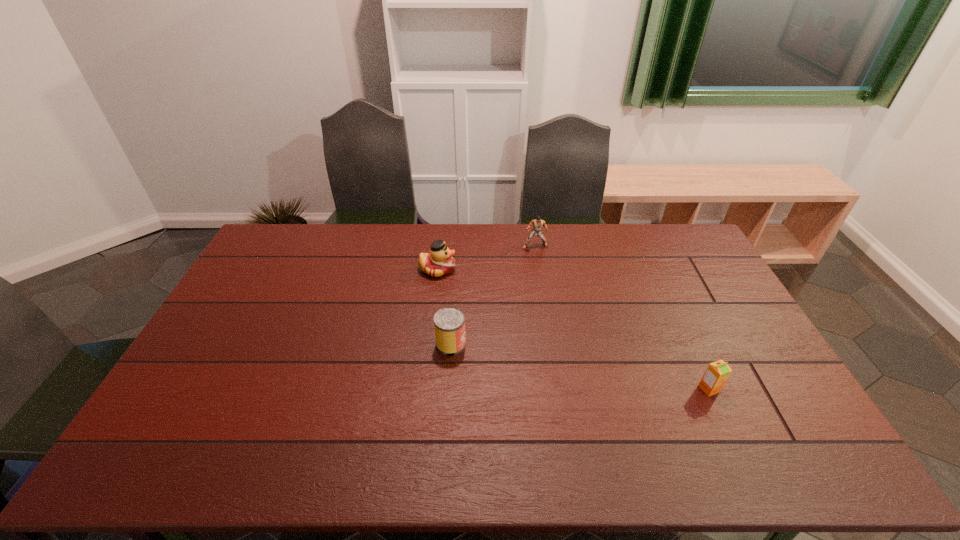
Locate an element on the screen. Image resolution: width=960 pixels, height=540 pixels. object that is the second closest to the second farthest object is located at coordinates (537, 224).

Locate an element on the screen. The width and height of the screenshot is (960, 540). vacant region that satisfies the following two spatial constraints: 1. on the front-facing side of the puncher; 2. on the face of the duck is located at coordinates (539, 269).

You are a GUI agent. You are given a task and a screenshot of the screen. Output one action in this format:
    pyautogui.click(x=<x>, y=<y>)
    Task: Click on the vacant space that satisfies the following two spatial constraints: 1. on the front-facing side of the second object from right to left; 2. on the face of the duck
    
    Given the screenshot: What is the action you would take?
    pyautogui.click(x=539, y=269)

Locate an element on the screen. Image resolution: width=960 pixels, height=540 pixels. vacant region that satisfies the following two spatial constraints: 1. on the front side of the third farthest object; 2. on the left side of the nearest object is located at coordinates (448, 389).

Locate an element on the screen. The image size is (960, 540). free space that satisfies the following two spatial constraints: 1. on the front-facing side of the puncher; 2. on the right side of the orange juice is located at coordinates (557, 389).

Where is `free region that satisfies the following two spatial constraints: 1. on the face of the orange juice; 2. on the right side of the duck`? The height and width of the screenshot is (540, 960). free region that satisfies the following two spatial constraints: 1. on the face of the orange juice; 2. on the right side of the duck is located at coordinates (423, 389).

The width and height of the screenshot is (960, 540). Find the location of `vacant space that satisfies the following two spatial constraints: 1. on the front-facing side of the puncher; 2. on the left side of the rightmost object`. vacant space that satisfies the following two spatial constraints: 1. on the front-facing side of the puncher; 2. on the left side of the rightmost object is located at coordinates (557, 389).

Where is `free spot that satisfies the following two spatial constraints: 1. on the face of the third nearest object; 2. on the left side of the orange juice`? The image size is (960, 540). free spot that satisfies the following two spatial constraints: 1. on the face of the third nearest object; 2. on the left side of the orange juice is located at coordinates (423, 389).

Locate an element on the screen. Image resolution: width=960 pixels, height=540 pixels. free space in the image that satisfies the following two spatial constraints: 1. on the back side of the second nearest object; 2. on the face of the third nearest object is located at coordinates (456, 269).

At what (x,y) coordinates should I click in order to perform the action: click on free space that satisfies the following two spatial constraints: 1. on the front-facing side of the second object from right to left; 2. on the face of the duck. Please return your answer as a coordinate pair (x, y). This screenshot has width=960, height=540. Looking at the image, I should click on (539, 269).